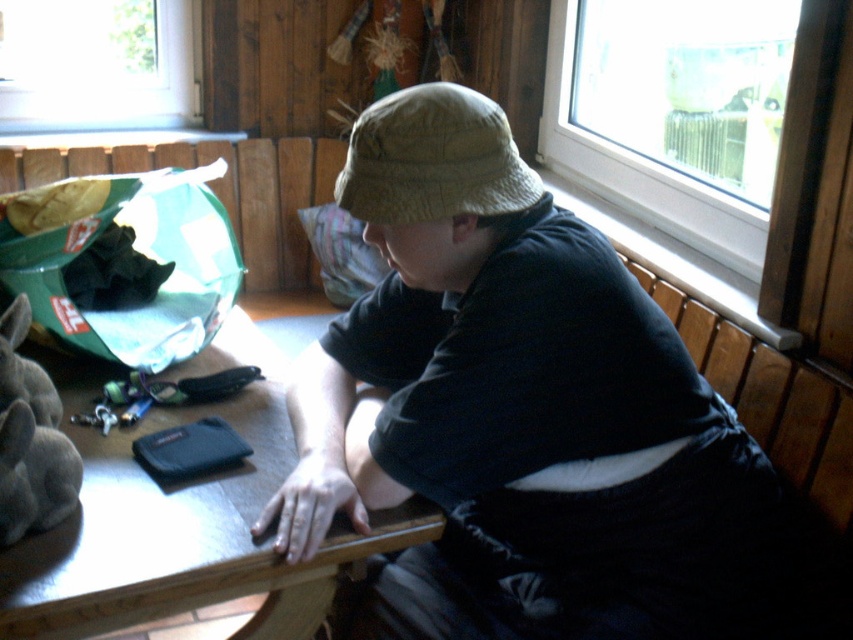
Question: Based on their relative distances, which object is farther from the transparent glass window at upper right?

Choices:
 (A) gray plush rabbit at lower left
 (B) matte khaki bucket hat at center
 (C) khaki fabric hat at center
 (D) transparent glass window at upper left

Answer: (A)

Question: Which object is farther from the camera taking this photo?

Choices:
 (A) khaki fabric hat at center
 (B) transparent glass window at upper left
 (C) wooden table at center

Answer: (B)

Question: Can you confirm if matte khaki bucket hat at center is positioned below khaki fabric hat at center?

Choices:
 (A) no
 (B) yes

Answer: (B)

Question: Which is farther from the wooden table at center?

Choices:
 (A) transparent glass window at upper left
 (B) matte khaki bucket hat at center
 (C) transparent glass window at upper right

Answer: (A)

Question: Can you confirm if wooden table at center is bigger than gray plush rabbit at lower left?

Choices:
 (A) yes
 (B) no

Answer: (A)

Question: Can you confirm if wooden table at center is positioned below khaki fabric hat at center?

Choices:
 (A) no
 (B) yes

Answer: (B)